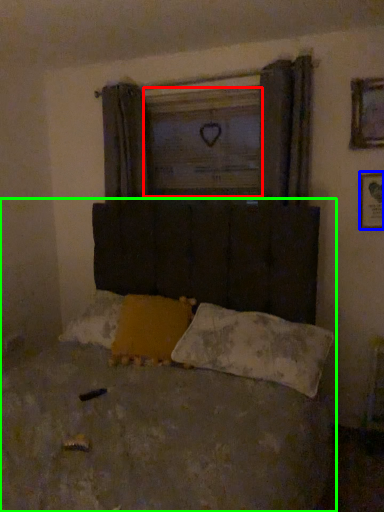
Question: Based on their relative distances, which object is farther from window screen (highlighted by a red box)? Choose from picture frame (highlighted by a blue box) and bed (highlighted by a green box).

Choices:
 (A) picture frame
 (B) bed

Answer: (B)